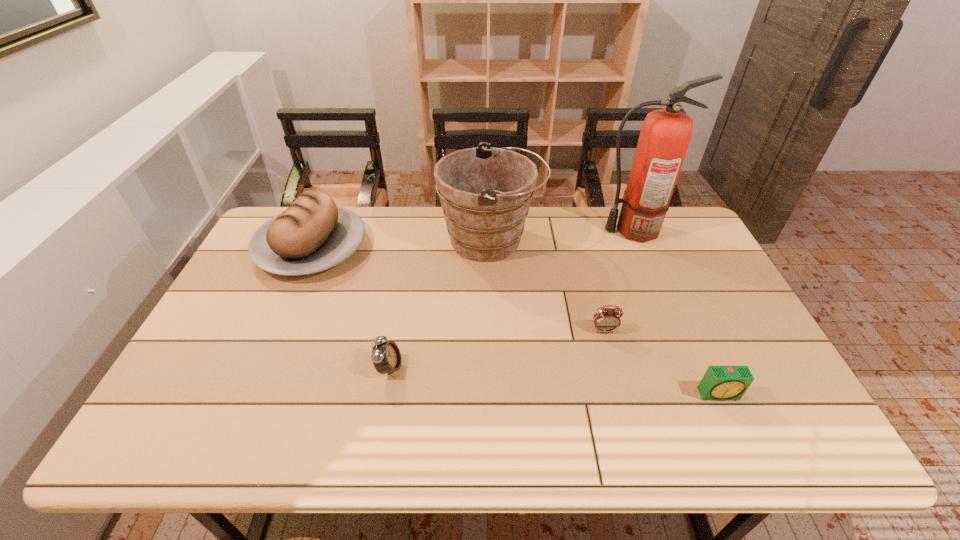
Locate an element on the screen. the rightmost alarm clock is located at coordinates (720, 383).

I want to click on vacant point located 0.260m on the nozzle of the fire extinguisher, so click(x=521, y=231).

Where is `vacant region located 0.130m on the nozzle of the fire extinguisher`? This screenshot has width=960, height=540. vacant region located 0.130m on the nozzle of the fire extinguisher is located at coordinates (559, 231).

At what (x,y) coordinates should I click in order to perform the action: click on vacant point located on the nozzle of the fire extinguisher. Please return your answer as a coordinate pair (x, y). This screenshot has width=960, height=540. Looking at the image, I should click on (564, 231).

Where is `blank space located on the handle side of the bucket`? Image resolution: width=960 pixels, height=540 pixels. blank space located on the handle side of the bucket is located at coordinates [x=598, y=241].

Identify the location of blank space located on the right of the leftmost object. (464, 248).

Locate an element on the screen. The width and height of the screenshot is (960, 540). vacant space positioned on the face of the fifth object from right to left is located at coordinates (557, 368).

I want to click on vacant space located on the face of the fourth farthest object, so click(615, 372).

At what (x,y) coordinates should I click in order to perform the action: click on free space located on the front-facing side of the nearest alarm clock. Please return your answer as a coordinate pair (x, y). Looking at the image, I should click on (744, 450).

The width and height of the screenshot is (960, 540). I want to click on fire extinguisher located in the far edge section of the desktop, so click(665, 135).